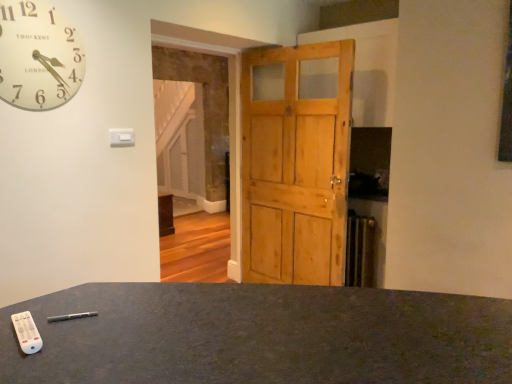
Find the location of a particular element. The height and width of the screenshot is (384, 512). vacant space to the right of white plastic remote at lower left is located at coordinates (97, 342).